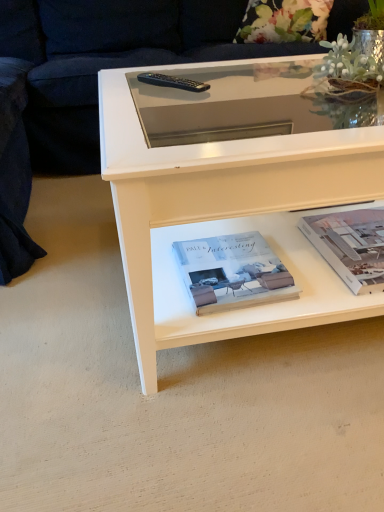
Question: Considering the relative positions of floral fabric pillow at upper center and white paper at lower right, positioned as the first paperback book in right-to-left order, in the image provided, is floral fabric pillow at upper center to the left of white paper at lower right, positioned as the first paperback book in right-to-left order, from the viewer's perspective?

Choices:
 (A) no
 (B) yes

Answer: (A)

Question: Is floral fabric pillow at upper center facing away from white paper at lower right, positioned as the first paperback book in right-to-left order?

Choices:
 (A) yes
 (B) no

Answer: (B)

Question: Can you confirm if floral fabric pillow at upper center is thinner than white paper at lower right, which ranks as the second paperback book in left-to-right order?

Choices:
 (A) no
 (B) yes

Answer: (A)

Question: Can we say floral fabric pillow at upper center lies outside white paper at lower right, positioned as the first paperback book in right-to-left order?

Choices:
 (A) yes
 (B) no

Answer: (A)

Question: Can you confirm if floral fabric pillow at upper center is smaller than white paper at lower right, positioned as the first paperback book in right-to-left order?

Choices:
 (A) no
 (B) yes

Answer: (A)

Question: Does floral fabric pillow at upper center have a greater height compared to white paper at lower right, positioned as the first paperback book in right-to-left order?

Choices:
 (A) yes
 (B) no

Answer: (A)

Question: Can you confirm if white matte book at center, the 2th paperback book viewed from the right, is thinner than black plastic remote at upper center?

Choices:
 (A) no
 (B) yes

Answer: (A)

Question: Is white matte book at center, the first paperback book positioned from the left, positioned in front of black plastic remote at upper center?

Choices:
 (A) yes
 (B) no

Answer: (A)

Question: Is white matte book at center, the first paperback book positioned from the left, looking in the opposite direction of black plastic remote at upper center?

Choices:
 (A) no
 (B) yes

Answer: (A)

Question: Can we say white matte book at center, the first paperback book positioned from the left, lies outside black plastic remote at upper center?

Choices:
 (A) no
 (B) yes

Answer: (B)

Question: From a real-world perspective, is white matte book at center, the 2th paperback book viewed from the right, under black plastic remote at upper center?

Choices:
 (A) no
 (B) yes

Answer: (B)

Question: From the image's perspective, is white matte book at center, the first paperback book positioned from the left, located above black plastic remote at upper center?

Choices:
 (A) yes
 (B) no

Answer: (B)

Question: Is white paper at lower right, which ranks as the second paperback book in left-to-right order, not near black plastic remote at upper center?

Choices:
 (A) yes
 (B) no

Answer: (B)